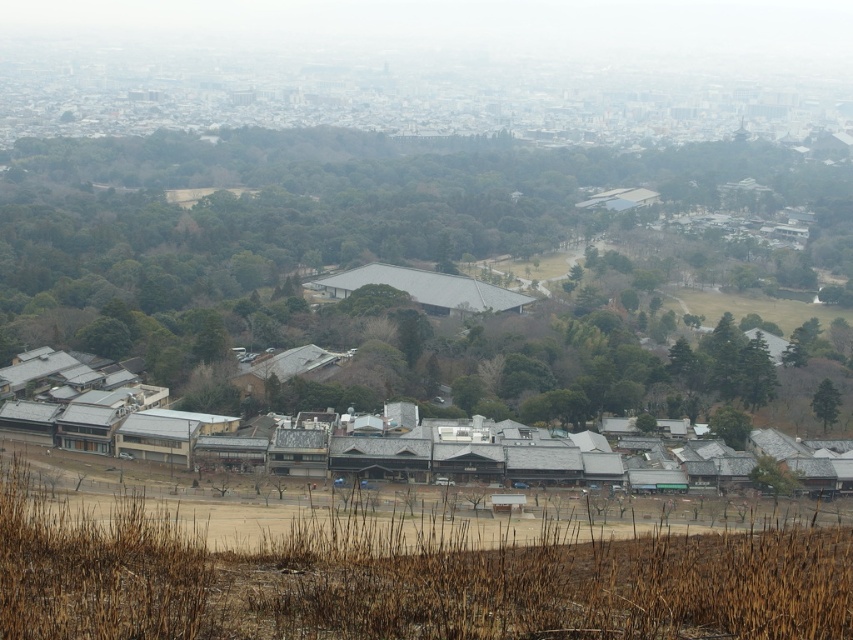
Can you confirm if gray concrete cityscape at upper center is positioned to the left of gray metallic building at lower center?

Incorrect, gray concrete cityscape at upper center is not on the left side of gray metallic building at lower center.

Between gray concrete cityscape at upper center and gray metallic building at lower center, which one has less height?

gray metallic building at lower center is shorter.

At what (x,y) coordinates should I click in order to perform the action: click on gray concrete cityscape at upper center. Please return your answer as a coordinate pair (x, y). Looking at the image, I should click on (405, 93).

This screenshot has height=640, width=853. I want to click on gray concrete cityscape at upper center, so click(x=405, y=93).

Between point (399, 467) and point (160, 458), which one is positioned behind?

The point (160, 458) is behind.

Is gray shingled hut at center positioned behind gray metallic building at lower center?

No, gray shingled hut at center is in front of gray metallic building at lower center.

The image size is (853, 640). What do you see at coordinates (379, 458) in the screenshot? I see `gray shingled hut at center` at bounding box center [379, 458].

Locate an element on the screen. gray shingled hut at center is located at coordinates (379, 458).

Can you confirm if gray concrete cityscape at upper center is taller than gray tile roof hut at center?

Yes.

Who is lower down, gray concrete cityscape at upper center or gray tile roof hut at center?

gray tile roof hut at center is lower down.

The image size is (853, 640). What do you see at coordinates (405, 93) in the screenshot? I see `gray concrete cityscape at upper center` at bounding box center [405, 93].

This screenshot has width=853, height=640. In order to click on gray concrete cityscape at upper center in this screenshot , I will do `click(405, 93)`.